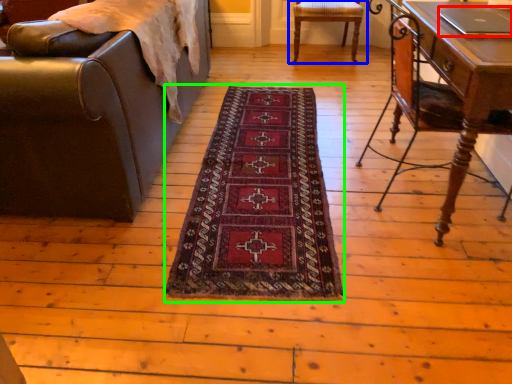
Question: Which object is positioned farthest from laptop (highlighted by a red box)? Select from chair (highlighted by a blue box) and mat (highlighted by a green box).

Choices:
 (A) chair
 (B) mat

Answer: (A)